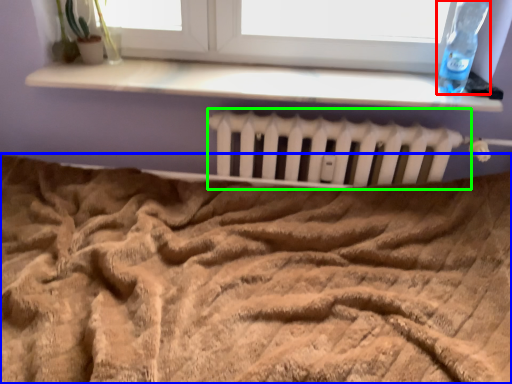
Question: Estimate the real-world distances between objects in this image. Which object is closer to bottle (highlighted by a red box), bed (highlighted by a blue box) or radiator (highlighted by a green box)?

Choices:
 (A) bed
 (B) radiator

Answer: (B)